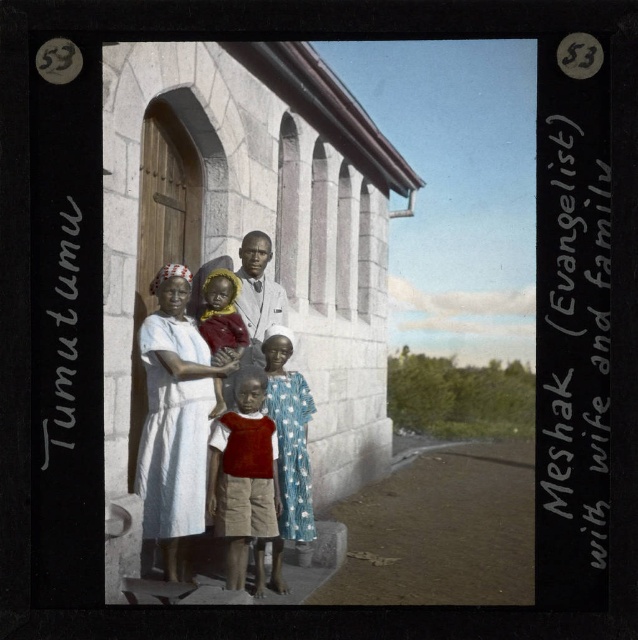
You are a photographer analyzing the vintage family photo. You notice two elements at the center of the image. One is the light brown skin tone at center and the other is the matte red cloth at center. Which of these two elements is wider?

The light brown skin tone at center is wider than the matte red cloth at center according to the description.

You are standing in front of the vintage photograph of a family and a stone building. You want to know how far the point at coordinates point (x=276, y=458) is from the camera. Can you tell me?

The point (x=276, y=458) is 7.70 meters away from the camera.

You are a photographer analyzing this vintage image. You notice two elements at the center of the scene. One is a light brown skin tone at center, and the other is a matte red cloth at center. Based on their positions, which one is located to the right?

The light brown skin tone at center is to the right of the matte red cloth at center.